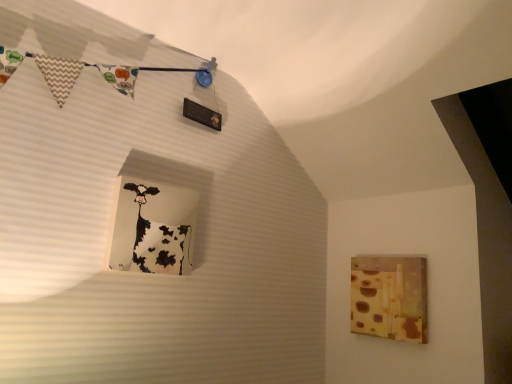
Question: Should I look upward or downward to see white glossy cow at upper left?

Choices:
 (A) down
 (B) up

Answer: (A)

Question: From the image's perspective, is matte yellow cheese at right on white glossy cow at upper left?

Choices:
 (A) yes
 (B) no

Answer: (B)

Question: Is matte yellow cheese at right positioned in front of white glossy cow at upper left?

Choices:
 (A) no
 (B) yes

Answer: (A)

Question: Would you say matte yellow cheese at right is a long distance from white glossy cow at upper left?

Choices:
 (A) no
 (B) yes

Answer: (A)

Question: From a real-world perspective, is matte yellow cheese at right physically above white glossy cow at upper left?

Choices:
 (A) yes
 (B) no

Answer: (B)

Question: Can white glossy cow at upper left be found inside matte yellow cheese at right?

Choices:
 (A) yes
 (B) no

Answer: (B)

Question: Can you confirm if matte yellow cheese at right is positioned to the right of white glossy cow at upper left?

Choices:
 (A) yes
 (B) no

Answer: (A)

Question: Is white glossy cow at upper left bigger than matte yellow cheese at right?

Choices:
 (A) yes
 (B) no

Answer: (B)

Question: Is white glossy cow at upper left further to camera compared to matte yellow cheese at right?

Choices:
 (A) no
 (B) yes

Answer: (A)

Question: Is white glossy cow at upper left completely or partially outside of matte yellow cheese at right?

Choices:
 (A) no
 (B) yes

Answer: (B)

Question: Is white glossy cow at upper left thinner than matte yellow cheese at right?

Choices:
 (A) yes
 (B) no

Answer: (B)

Question: Is the depth of white glossy cow at upper left less than that of matte yellow cheese at right?

Choices:
 (A) yes
 (B) no

Answer: (A)

Question: Considering the relative sizes of white glossy cow at upper left and matte yellow cheese at right in the image provided, is white glossy cow at upper left wider than matte yellow cheese at right?

Choices:
 (A) yes
 (B) no

Answer: (A)

Question: Relative to matte yellow cheese at right, is white glossy cow at upper left in front or behind?

Choices:
 (A) front
 (B) behind

Answer: (A)